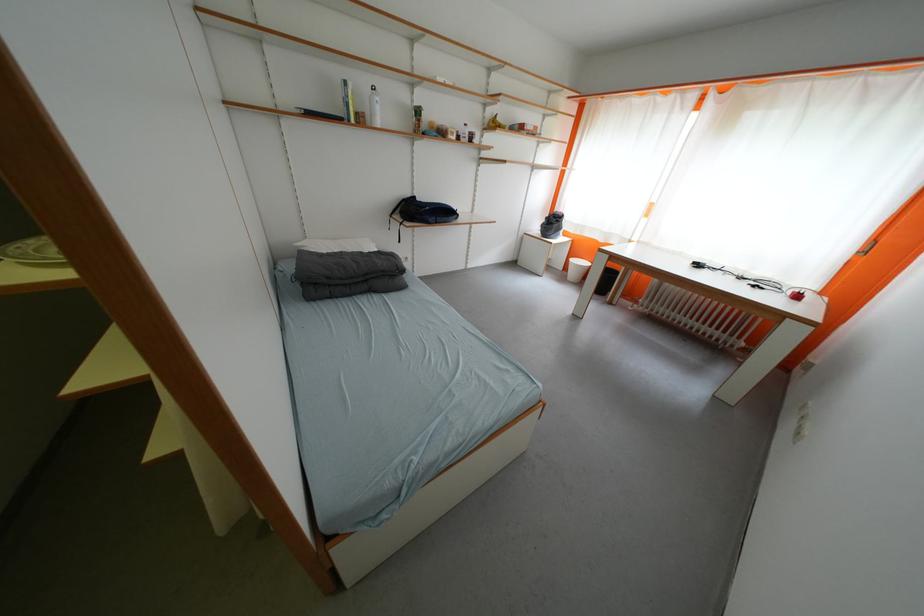
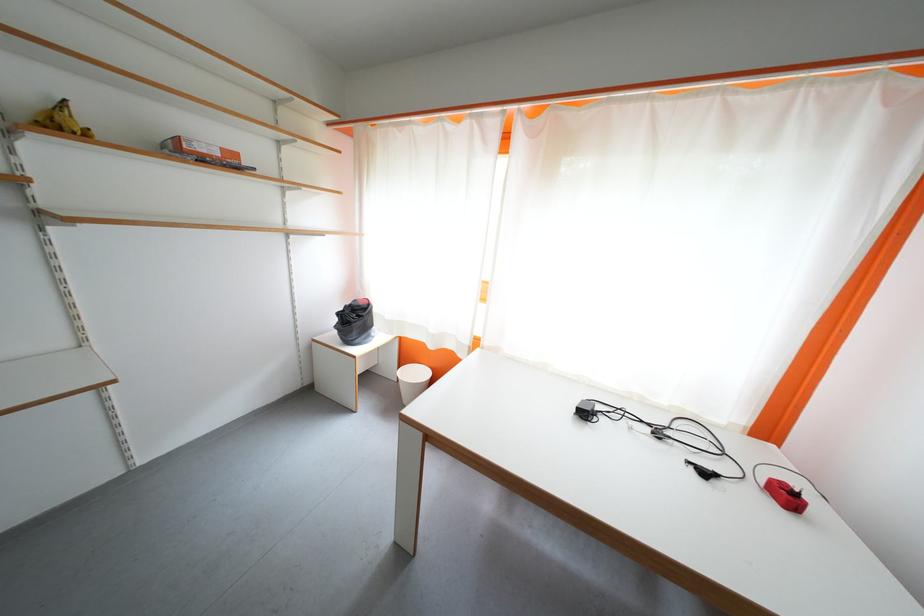
In the second image, find the point that corresponds to (503,128) in the first image.

(68, 129)